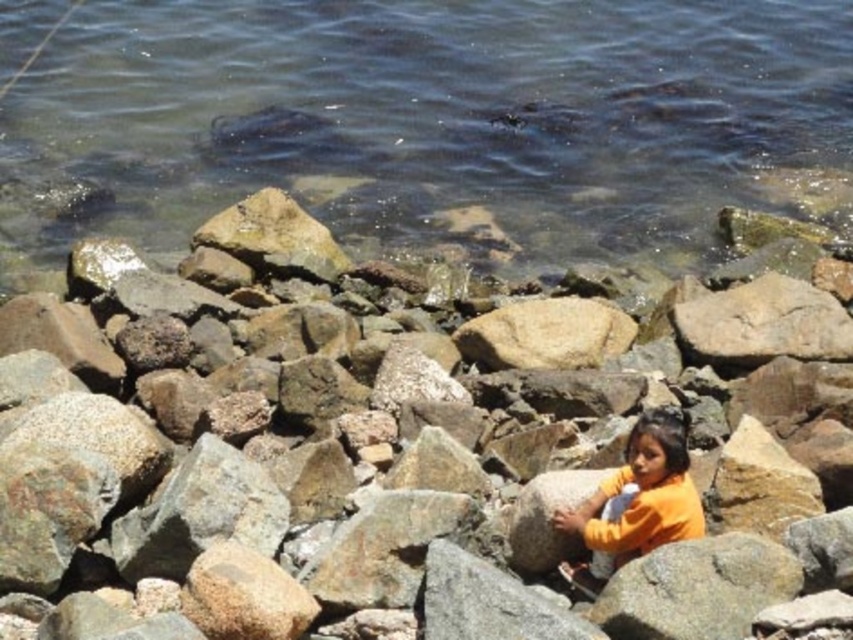
Question: Is clear water at upper center further to the viewer compared to orange cotton shirt at center?

Choices:
 (A) yes
 (B) no

Answer: (A)

Question: Estimate the real-world distances between objects in this image. Which object is closer to the orange cotton shirt at center?

Choices:
 (A) clear water at upper center
 (B) smooth gray rock at center

Answer: (B)

Question: Which is nearer to the orange cotton shirt at center?

Choices:
 (A) smooth gray rock at center
 (B) clear water at upper center

Answer: (A)

Question: Can you confirm if clear water at upper center is positioned to the right of orange cotton shirt at center?

Choices:
 (A) no
 (B) yes

Answer: (A)

Question: Can you confirm if smooth gray rock at center is bigger than clear water at upper center?

Choices:
 (A) no
 (B) yes

Answer: (A)

Question: Which point is closer to the camera?

Choices:
 (A) clear water at upper center
 (B) orange cotton shirt at center

Answer: (B)